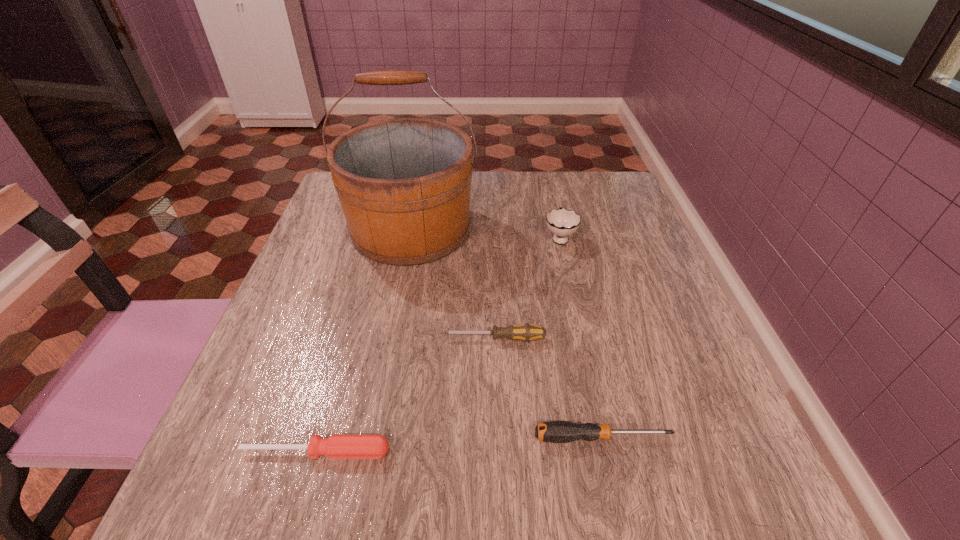
The height and width of the screenshot is (540, 960). I want to click on the tallest object, so (404, 184).

What are the coordinates of `the second tallest object` in the screenshot? It's located at (561, 222).

Where is `the farthest screwdriver`? This screenshot has height=540, width=960. the farthest screwdriver is located at coordinates (526, 332).

The image size is (960, 540). In order to click on the leftmost screwdriver in this screenshot , I will do `click(336, 446)`.

Identify the location of vacant area situated on the front of the tallest object. This screenshot has height=540, width=960. (386, 355).

Identify the location of vacant space positioned on the side of the cup with the handle. coord(547,180).

I want to click on vacant area located on the side of the cup with the handle, so click(555, 214).

Find the location of a particular element. The height and width of the screenshot is (540, 960). vacant space located on the side of the cup with the handle is located at coordinates (547, 183).

I want to click on free space located at the tip of the third nearest object, so click(x=405, y=339).

Image resolution: width=960 pixels, height=540 pixels. I want to click on free point located 0.050m at the tip of the third nearest object, so click(x=416, y=339).